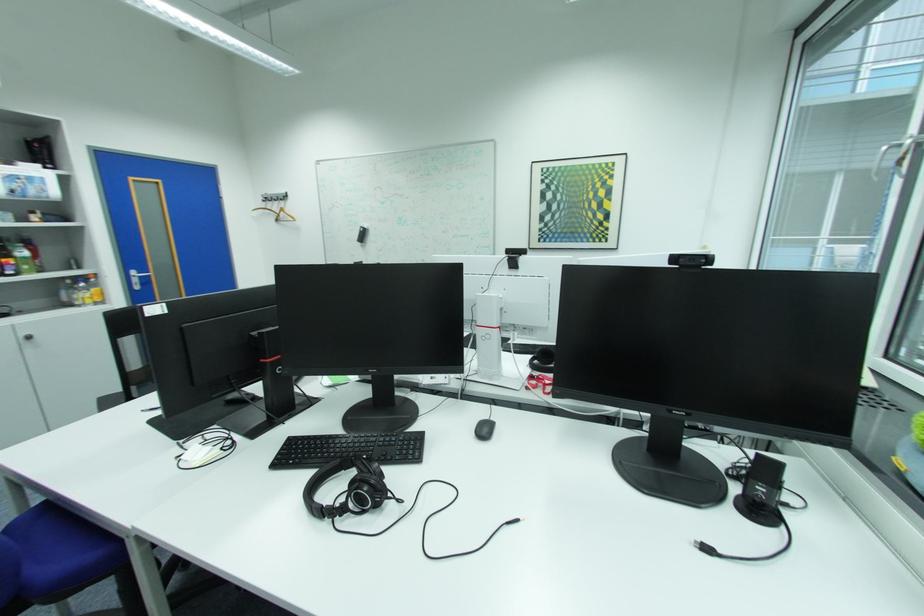
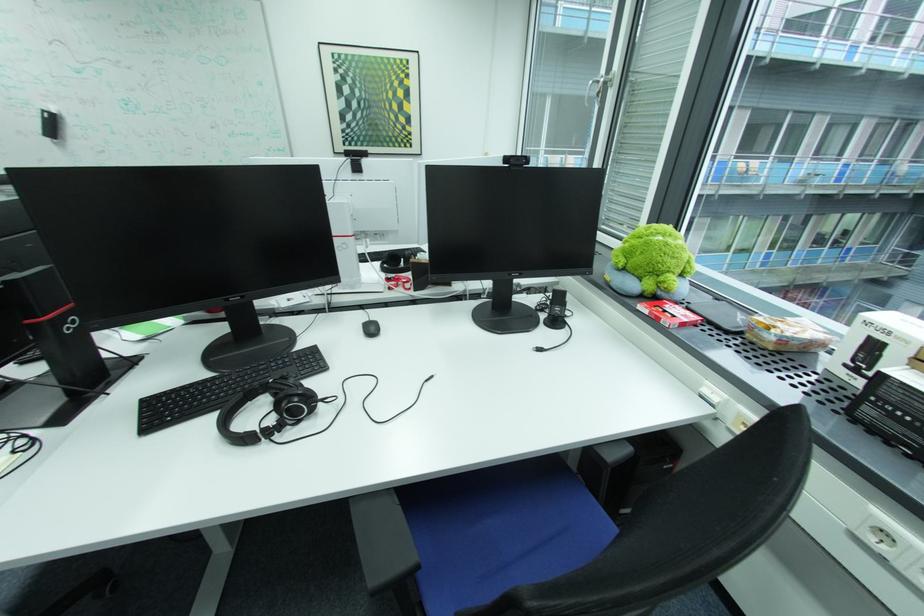
Based on the continuous images, in which direction is the camera rotating?

The camera's rotation is toward right-down.